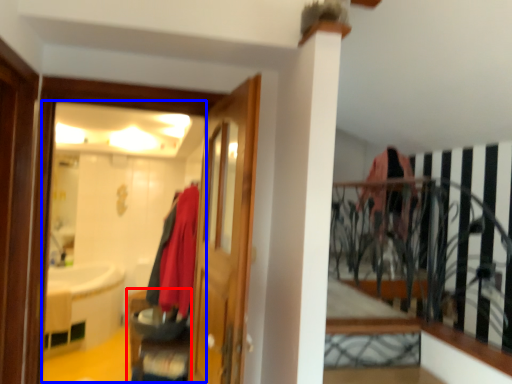
Question: Which object appears closest to the camera in this image, furniture (highlighted by a red box) or mirror (highlighted by a blue box)?

Choices:
 (A) furniture
 (B) mirror

Answer: (B)